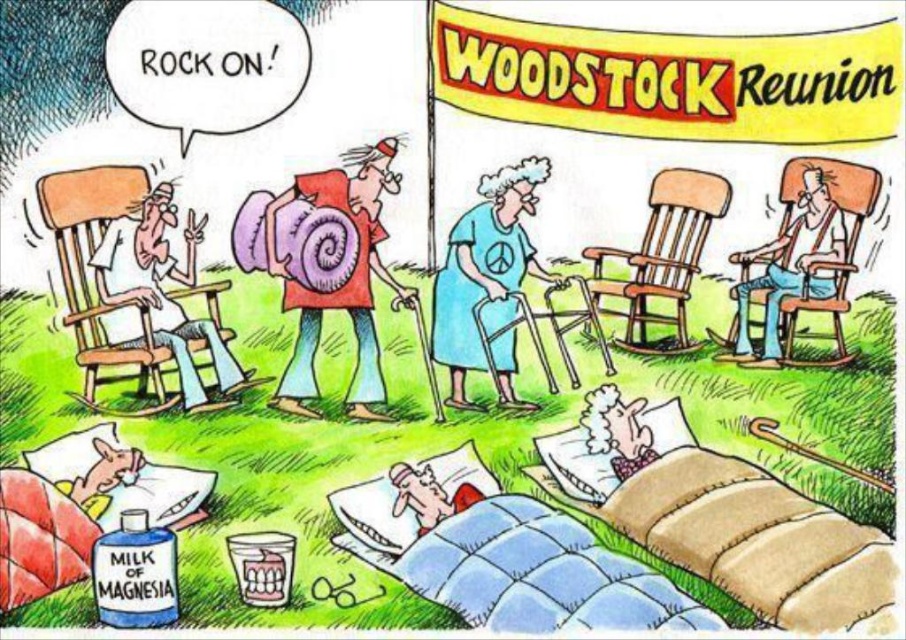
You are a photographer at the Woodstock Reunion scene. You want to take a photo of the matte red shirt at center and white fabric shirt at left. Which shirt should you focus on first to ensure both are in the frame without moving the camera?

You should focus on the matte red shirt at center first because the white fabric shirt at left is behind it, so focusing on the front shirt will keep both in focus.

You are at the Woodstock Reunion and need to choose seating for a nap. You have a preference for larger seating options. Which object between the blue fabric walker at center and the smooth brown chair at right should you choose?

The blue fabric walker at center is bigger than the smooth brown chair at right, so you should choose the blue fabric walker at center for a larger seating option.